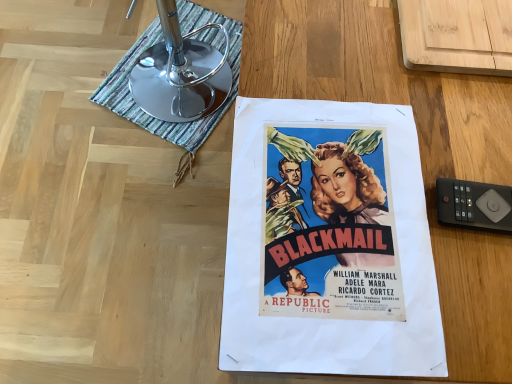
The image size is (512, 384). What do you see at coordinates (329, 243) in the screenshot?
I see `white paper poster at center` at bounding box center [329, 243].

Locate an element on the screen. The image size is (512, 384). white paper poster at center is located at coordinates (329, 243).

I want to click on white paper poster at center, so click(329, 243).